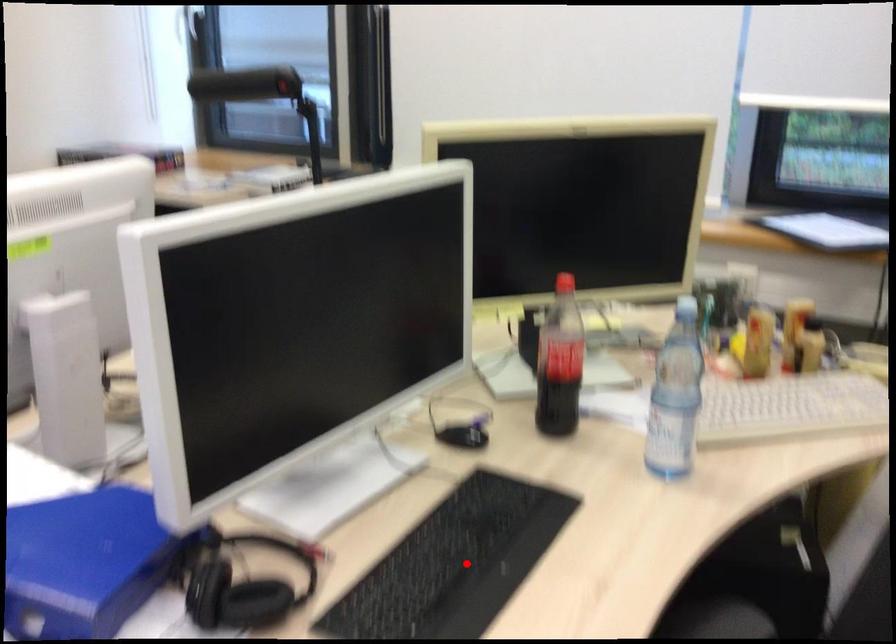
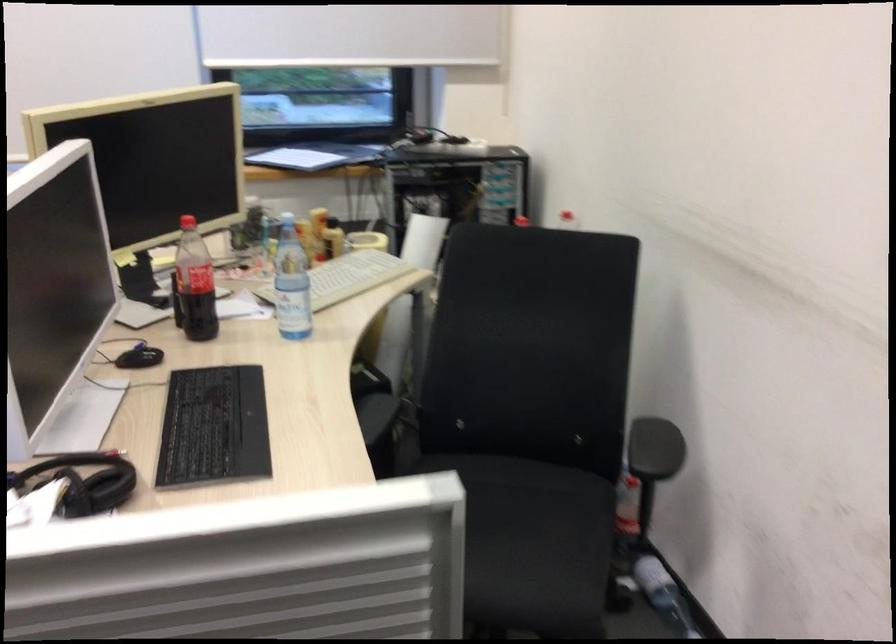
In the second image, find the point that corresponds to the highlighted location in the first image.

(213, 428)